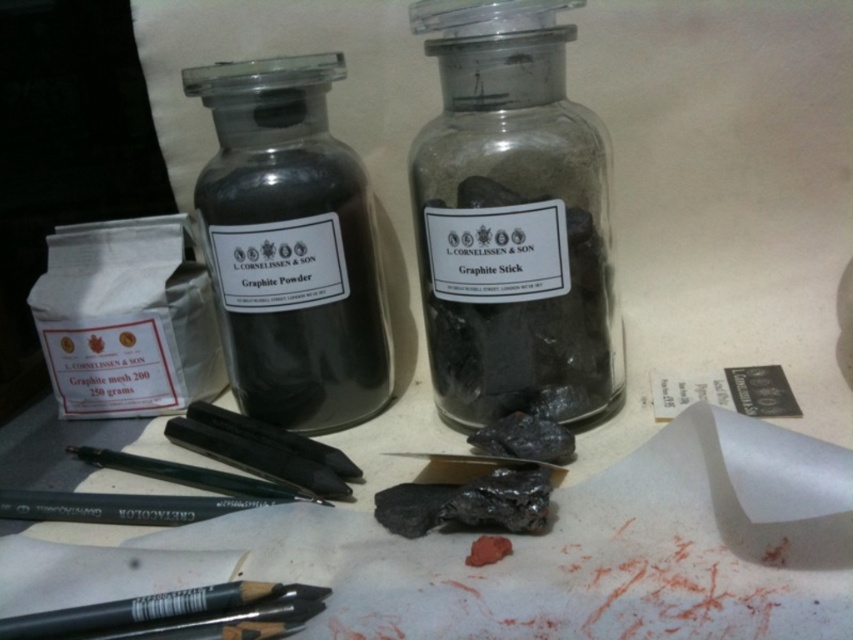
Does point (305, 90) come farther from viewer compared to point (213, 476)?

Yes, point (305, 90) is farther from viewer.

In the scene shown: Can you confirm if matte glass bottle at center is positioned below matte black pencil at center?

No, matte glass bottle at center is not below matte black pencil at center.

Is point (310, 403) farther from camera compared to point (181, 464)?

Yes.

Find the location of a particular element. The width and height of the screenshot is (853, 640). matte glass bottle at center is located at coordinates (289, 246).

Is matte glass bottle at center closer to the viewer compared to matte black pencil at lower left?

No, it is behind matte black pencil at lower left.

From the picture: Who is taller, matte glass bottle at center or matte black pencil at lower left?

Standing taller between the two is matte glass bottle at center.

Describe the element at coordinates (289, 246) in the screenshot. The height and width of the screenshot is (640, 853). I see `matte glass bottle at center` at that location.

The width and height of the screenshot is (853, 640). What are the coordinates of `matte glass bottle at center` in the screenshot? It's located at (289, 246).

Can you confirm if transparent glass jar at center is positioned to the right of matte glass bottle at center?

Yes, transparent glass jar at center is to the right of matte glass bottle at center.

Measure the distance between transparent glass jar at center and camera.

A distance of 33.52 inches exists between transparent glass jar at center and camera.

Which is behind, point (422, 20) or point (299, 410)?

Positioned behind is point (299, 410).

This screenshot has width=853, height=640. Find the location of `transparent glass jar at center`. transparent glass jar at center is located at coordinates (512, 220).